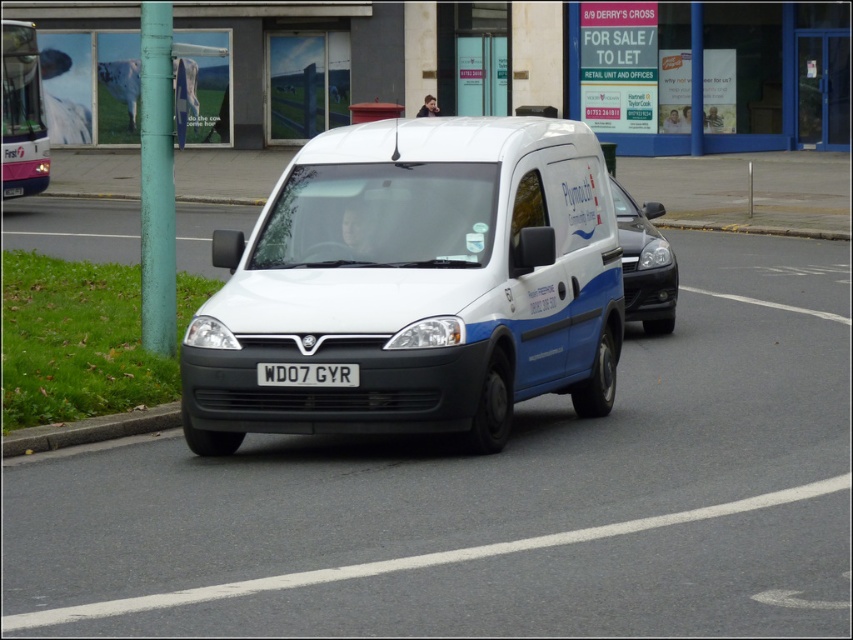
Between pink plastic bus at upper left and glossy black car at center, which one is positioned higher?

pink plastic bus at upper left is higher up.

Looking at this image, between pink plastic bus at upper left and glossy black car at center, which one has less height?

With less height is glossy black car at center.

What do you see at coordinates (22, 113) in the screenshot? I see `pink plastic bus at upper left` at bounding box center [22, 113].

Find the location of a particular element. This screenshot has width=853, height=640. pink plastic bus at upper left is located at coordinates (22, 113).

You are a GUI agent. You are given a task and a screenshot of the screen. Output one action in this format:
    pyautogui.click(x=<x>, y=<y>)
    Task: Click on the glossy black car at center
    This screenshot has height=640, width=853.
    Given the screenshot: What is the action you would take?
    pyautogui.click(x=645, y=262)

How distant is glossy black car at center from white metallic license plate at center?

glossy black car at center and white metallic license plate at center are 6.84 meters apart from each other.

Identify the location of glossy black car at center. The height and width of the screenshot is (640, 853). (645, 262).

Between point (372, 188) and point (642, 253), which one is positioned in front?

Point (372, 188)

Which is above, white matte van at center or glossy black car at center?

Positioned higher is glossy black car at center.

The width and height of the screenshot is (853, 640). I want to click on white matte van at center, so point(415,284).